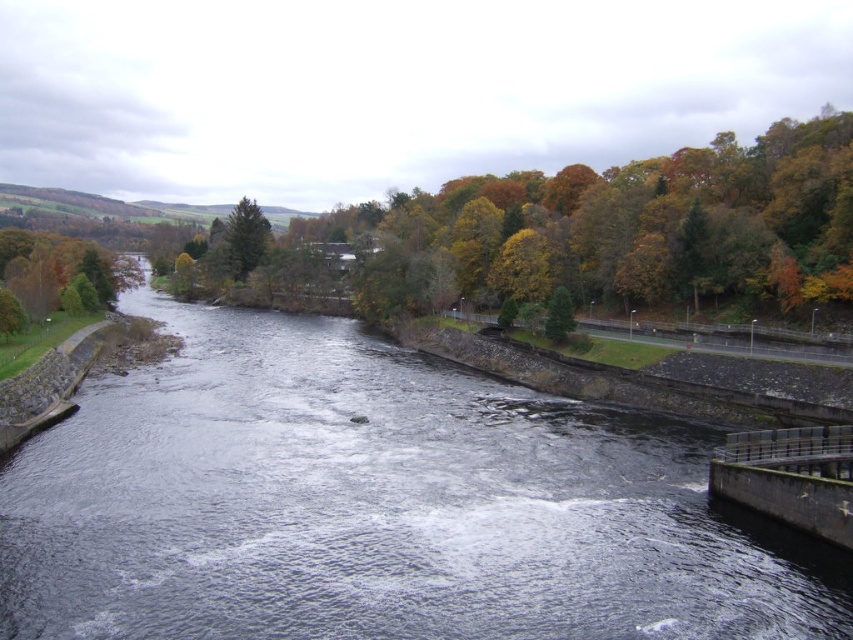
Question: Observing the image, what is the correct spatial positioning of dark gray water at center in reference to green matte tree at left?

Choices:
 (A) below
 (B) above

Answer: (A)

Question: Estimate the real-world distances between objects in this image. Which object is farther from the green matte tree at center?

Choices:
 (A) dark gray water at center
 (B) green matte tree at left

Answer: (B)

Question: Which object is the farthest from the green matte tree at upper center?

Choices:
 (A) dark gray water at center
 (B) green matte tree at left

Answer: (A)

Question: Which object appears closest to the camera in this image?

Choices:
 (A) green matte tree at upper center
 (B) green matte tree at left
 (C) dark gray water at center
 (D) green matte tree at center

Answer: (C)

Question: Is green matte tree at left above green matte tree at center?

Choices:
 (A) yes
 (B) no

Answer: (A)

Question: Observing the image, what is the correct spatial positioning of dark gray water at center in reference to green matte tree at upper center?

Choices:
 (A) above
 (B) below

Answer: (B)